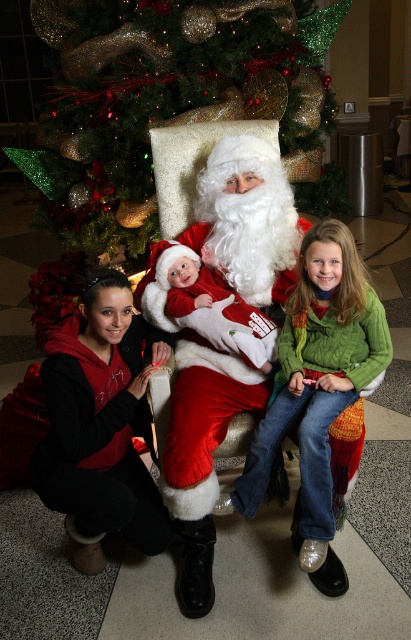
Does fuzzy white santa at center appear on the right side of green knitted sweater at center?

No, fuzzy white santa at center is not to the right of green knitted sweater at center.

This screenshot has height=640, width=411. Describe the element at coordinates (223, 333) in the screenshot. I see `fuzzy white santa at center` at that location.

Image resolution: width=411 pixels, height=640 pixels. Find the location of `fuzzy white santa at center`. fuzzy white santa at center is located at coordinates (223, 333).

Between matte red santa suit at center and green knitted sweater at center, which one appears on the right side from the viewer's perspective?

Positioned to the right is green knitted sweater at center.

How far apart are matte red santa suit at center and green knitted sweater at center?

matte red santa suit at center and green knitted sweater at center are 4.27 inches apart from each other.

Where is `matte red santa suit at center`? The image size is (411, 640). matte red santa suit at center is located at coordinates (260, 227).

Can you confirm if green glittery christmas tree at upper center is positioned below matte red santa suit at center?

Incorrect, green glittery christmas tree at upper center is not positioned below matte red santa suit at center.

Between green glittery christmas tree at upper center and matte red santa suit at center, which one appears on the right side from the viewer's perspective?

matte red santa suit at center is more to the right.

The width and height of the screenshot is (411, 640). What are the coordinates of `green glittery christmas tree at upper center` in the screenshot? It's located at (x=166, y=99).

Image resolution: width=411 pixels, height=640 pixels. I want to click on green glittery christmas tree at upper center, so click(166, 99).